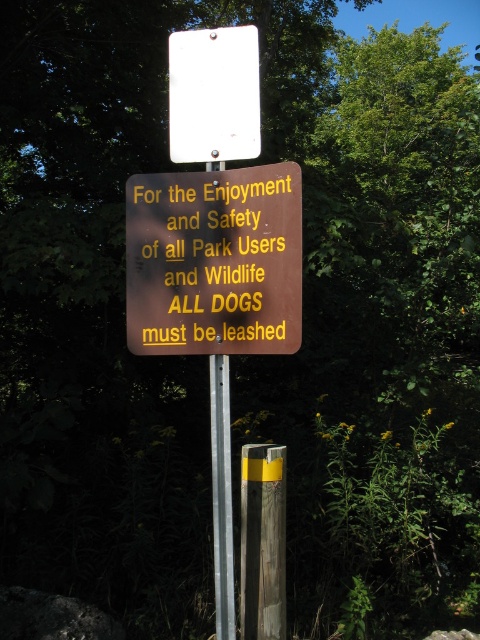
Can you confirm if brown matte sign at center is positioned below silver metallic pole at center?

Incorrect, brown matte sign at center is not positioned below silver metallic pole at center.

Does brown matte sign at center have a smaller size compared to silver metallic pole at center?

Actually, brown matte sign at center might be larger than silver metallic pole at center.

Which is in front, point (277, 250) or point (224, 566)?

Positioned in front is point (277, 250).

You are a GUI agent. You are given a task and a screenshot of the screen. Output one action in this format:
    pyautogui.click(x=<x>, y=<y>)
    Task: Click on the brown matte sign at center
    The image size is (480, 640).
    Given the screenshot: What is the action you would take?
    pyautogui.click(x=215, y=260)

Does white paper at upper center appear on the right side of silver metallic pole at center?

Incorrect, white paper at upper center is not on the right side of silver metallic pole at center.

Is point (228, 115) more distant than point (216, 588)?

That is True.

You are a GUI agent. You are given a task and a screenshot of the screen. Output one action in this format:
    pyautogui.click(x=<x>, y=<y>)
    Task: Click on the white paper at upper center
    The image size is (480, 640).
    Given the screenshot: What is the action you would take?
    pyautogui.click(x=214, y=96)

In the scene shown: Does white paper at upper center appear over yellow painted wood post at center?

Yes.

Which of these two, white paper at upper center or yellow painted wood post at center, stands taller?

yellow painted wood post at center

Is point (242, 150) farther from camera compared to point (242, 637)?

No.

This screenshot has width=480, height=640. Identify the location of white paper at upper center. (214, 96).